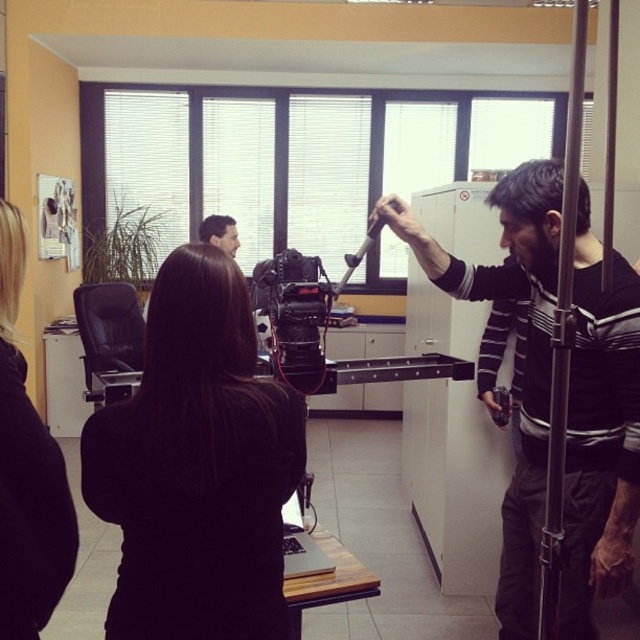
Is striped sweater at right above matte black camera at upper center?

No, striped sweater at right is not above matte black camera at upper center.

Which is below, striped sweater at right or matte black camera at upper center?

Positioned lower is striped sweater at right.

You are a GUI agent. You are given a task and a screenshot of the screen. Output one action in this format:
    pyautogui.click(x=<x>, y=<y>)
    Task: Click on the striped sweater at right
    The width and height of the screenshot is (640, 640).
    Given the screenshot: What is the action you would take?
    pyautogui.click(x=600, y=433)

What are the coordinates of `striped sweater at right` in the screenshot? It's located at (600, 433).

Can you confirm if striped sweater at right is positioned to the right of dark brown hair at upper right?

Incorrect, striped sweater at right is not on the right side of dark brown hair at upper right.

Between striped sweater at right and dark brown hair at upper right, which one is positioned higher?

dark brown hair at upper right is higher up.

Does point (550, 378) lie behind point (490, 204)?

No, (550, 378) is closer to viewer.

Image resolution: width=640 pixels, height=640 pixels. Identify the location of striped sweater at right. (600, 433).

Is the position of black matte hair at upper center more distant than that of dark brown hair at upper right?

No, it is in front of dark brown hair at upper right.

Can you confirm if black matte hair at upper center is bigger than dark brown hair at upper right?

Actually, black matte hair at upper center might be smaller than dark brown hair at upper right.

What are the coordinates of `black matte hair at upper center` in the screenshot? It's located at (26, 472).